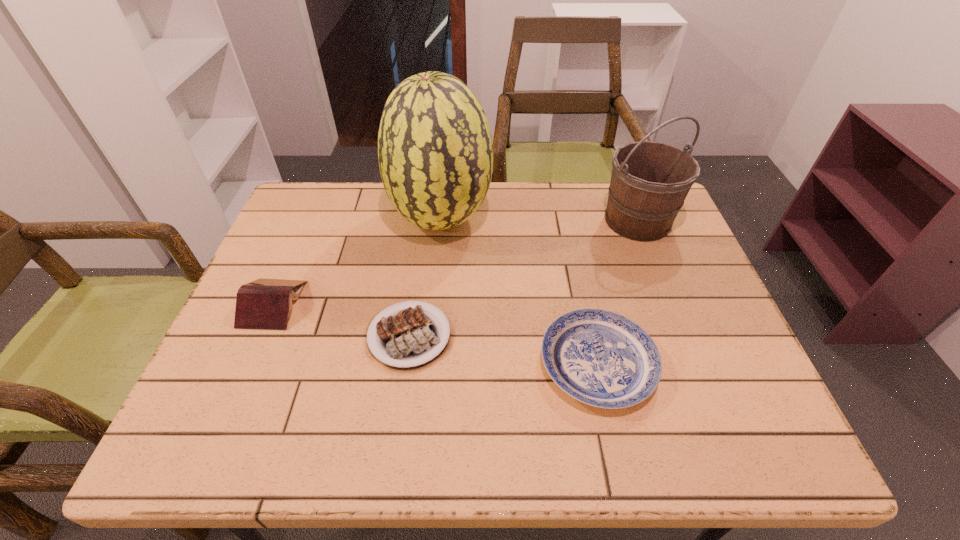
In order to click on vacant space located 0.070m on the right of the book in this screenshot , I will do `click(329, 303)`.

Identify the location of vacant region located on the left of the taller plate. The height and width of the screenshot is (540, 960). 446,363.

The width and height of the screenshot is (960, 540). Find the location of `free location located 0.190m on the left of the shorter plate`. free location located 0.190m on the left of the shorter plate is located at coordinates (277, 335).

Identify the location of watermelon that is at the far edge. (435, 153).

Where is `bucket present at the far edge`? The height and width of the screenshot is (540, 960). bucket present at the far edge is located at coordinates (649, 182).

Where is `object at the near edge`? object at the near edge is located at coordinates (600, 358).

Locate an element on the screen. Image resolution: width=960 pixels, height=540 pixels. object that is at the left edge is located at coordinates (264, 303).

This screenshot has height=540, width=960. I want to click on object present at the right edge, so click(x=649, y=182).

What are the coordinates of `object positioned at the far right corner` in the screenshot? It's located at (649, 182).

The height and width of the screenshot is (540, 960). I want to click on vacant space at the far edge of the desktop, so click(605, 232).